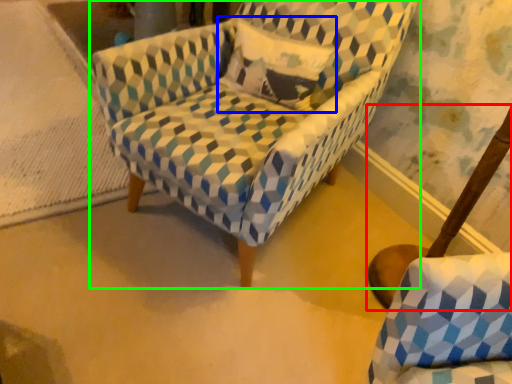
Question: Which object is positioned farthest from swivel chair (highlighted by a red box)? Select from throw pillow (highlighted by a blue box) and chair (highlighted by a green box).

Choices:
 (A) throw pillow
 (B) chair

Answer: (A)